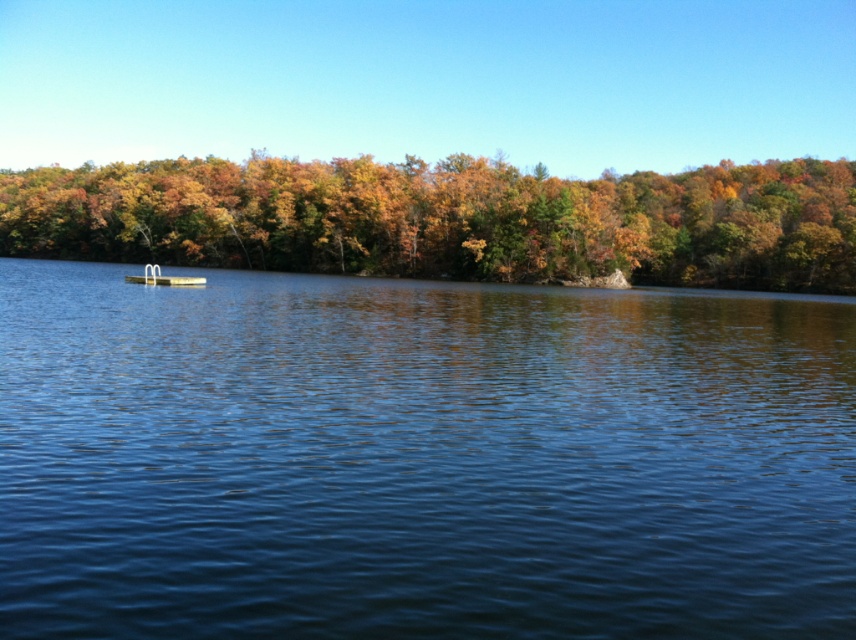
You are planning to take a photo of the white plastic boat at center and the blue water at center from the lakeside. Which object should you focus on first if you want to capture both in the same frame without moving the camera?

The white plastic boat at center should be focused on first because the blue water at center is positioned to its right, so adjusting focus to include both would require ensuring the boat is centered before the water extends to the right side of the frame.

You are planning to take a photo of the blue water at center and the white plastic boat at center from a position where both are visible. Which object will appear taller in the photo?

The blue water at center appears taller in the photo because it has a greater height compared to the white plastic boat at center according to the description.

You are standing on the lakeside and want to take a photo of the white plastic boat at center with the green matte tree at upper center in the background. Based on their positions, will the tree appear to the left or right side of the boat in the photo?

The green matte tree at upper center is positioned to the left of the white plastic boat at center, so in the photo, the tree will appear on the left side of the boat.